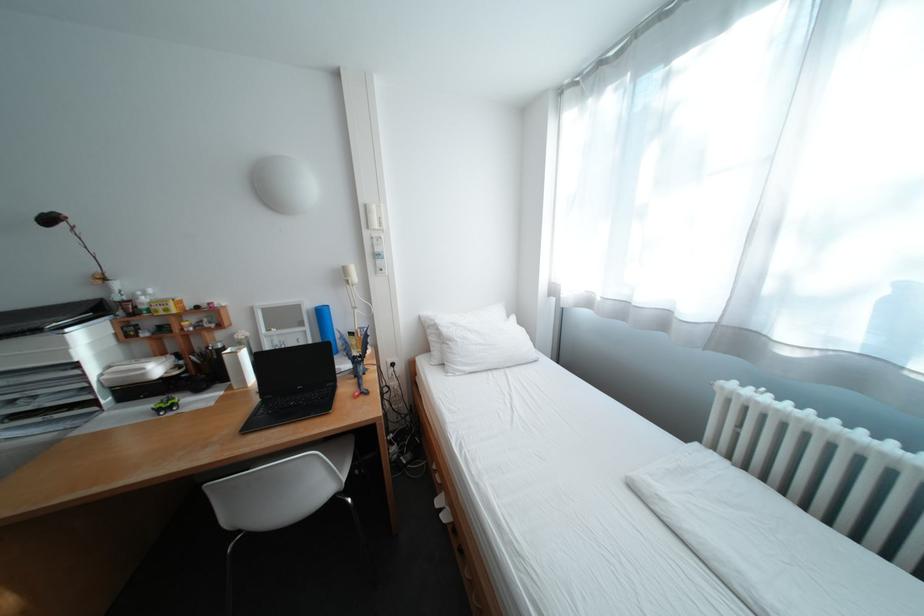
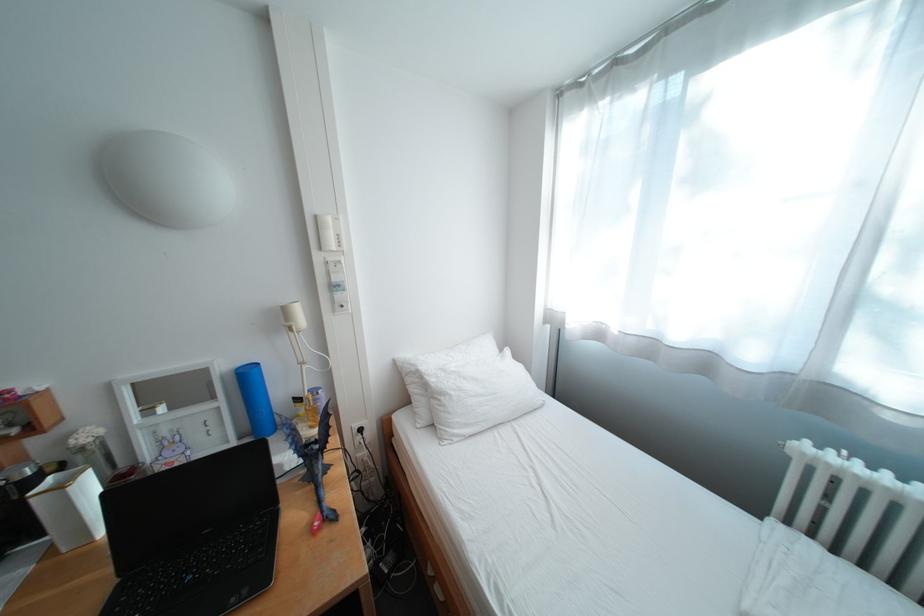
Which direction would the cameraman need to move to produce the second image?

The cameraman walked toward left, forward.